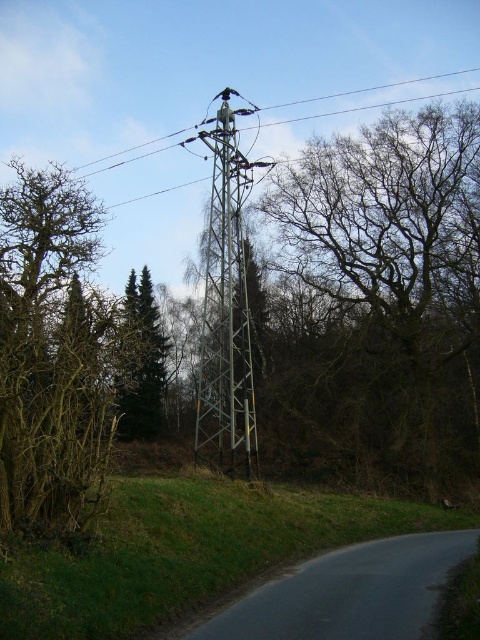
Question: Which point is closer to the camera?

Choices:
 (A) metallic gray tower at center
 (B) bare branches at center

Answer: (A)

Question: Considering the relative positions of bare branches at center and metallic gray tower at center in the image provided, where is bare branches at center located with respect to metallic gray tower at center?

Choices:
 (A) below
 (B) above

Answer: (B)

Question: Which of the following is the farthest from the observer?

Choices:
 (A) (x=36, y=212)
 (B) (x=128, y=291)
 (C) (x=239, y=93)
 (D) (x=396, y=317)

Answer: (B)

Question: Can you confirm if brown/dry wood at left is positioned to the right of green matte tree at center-left?

Choices:
 (A) yes
 (B) no

Answer: (B)

Question: Is bare branches at center bigger than metallic gray tower at center?

Choices:
 (A) yes
 (B) no

Answer: (A)

Question: Based on their relative distances, which object is nearer to the green matte tree at center-left?

Choices:
 (A) bare branches at center
 (B) metallic gray tower at center
 (C) brown/dry wood at left

Answer: (B)